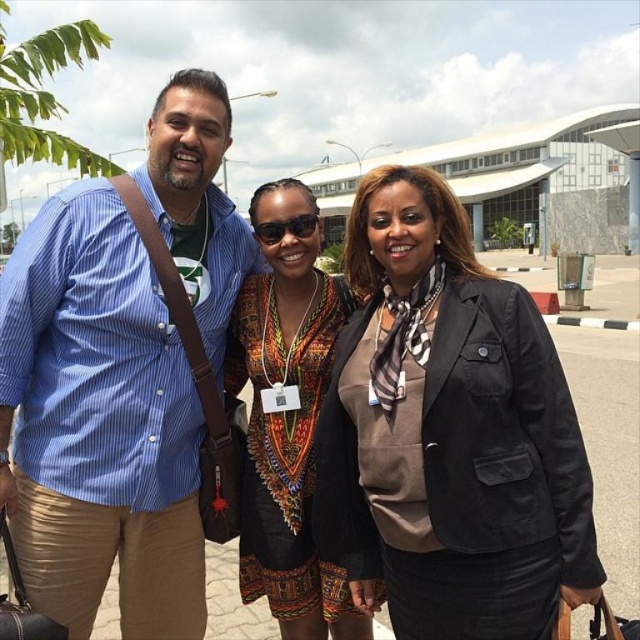
Question: Which point is closer to the camera taking this photo?

Choices:
 (A) (308, 460)
 (B) (42, 224)

Answer: (B)

Question: Which is nearer to the black matte blazer at center?

Choices:
 (A) blue striped shirt at left
 (B) printed fabric dress at center

Answer: (B)

Question: Is black matte blazer at center smaller than blue striped shirt at left?

Choices:
 (A) no
 (B) yes

Answer: (A)

Question: Can you confirm if black matte blazer at center is smaller than blue striped shirt at left?

Choices:
 (A) no
 (B) yes

Answer: (A)

Question: Which of these objects is positioned farthest from the blue striped shirt at left?

Choices:
 (A) black matte blazer at center
 (B) printed fabric dress at center

Answer: (A)

Question: Does blue striped shirt at left have a larger size compared to printed fabric dress at center?

Choices:
 (A) yes
 (B) no

Answer: (B)